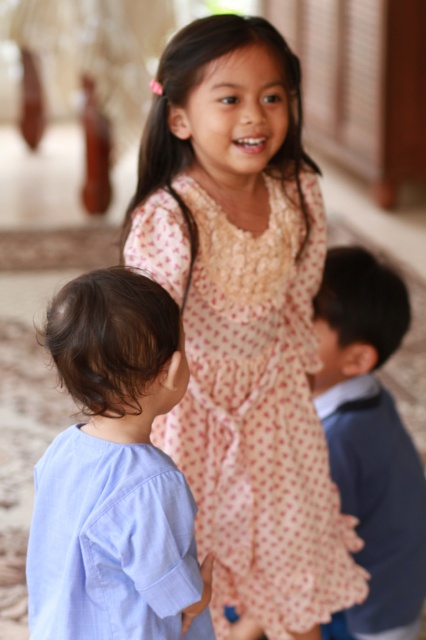
Based on the photo, is pink polka dot dress at center closer to camera compared to blue wool sweater at right?

Yes, it is in front of blue wool sweater at right.

What do you see at coordinates (259, 417) in the screenshot? This screenshot has width=426, height=640. I see `pink polka dot dress at center` at bounding box center [259, 417].

Locate an element on the screen. Image resolution: width=426 pixels, height=640 pixels. pink polka dot dress at center is located at coordinates tap(259, 417).

Between light blue cotton shirt at lower left and blue wool sweater at right, which one has less height?

Standing shorter between the two is light blue cotton shirt at lower left.

Who is higher up, light blue cotton shirt at lower left or blue wool sweater at right?

light blue cotton shirt at lower left is higher up.

Which is behind, point (144, 627) or point (397, 532)?

Point (397, 532)

Locate an element on the screen. The height and width of the screenshot is (640, 426). light blue cotton shirt at lower left is located at coordinates (114, 472).

Between pink polka dot dress at center and light blue cotton shirt at lower left, which one has more height?

With more height is pink polka dot dress at center.

What do you see at coordinates (259, 417) in the screenshot?
I see `pink polka dot dress at center` at bounding box center [259, 417].

What do you see at coordinates (259, 417) in the screenshot? I see `pink polka dot dress at center` at bounding box center [259, 417].

Locate an element on the screen. This screenshot has width=426, height=640. pink polka dot dress at center is located at coordinates (259, 417).